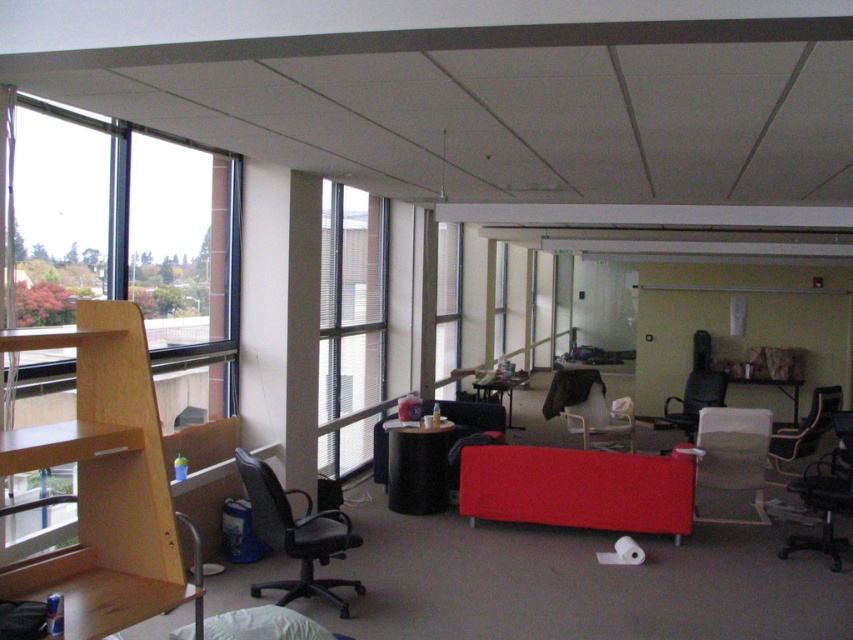
You are an office worker trying to locate the window to open it for fresh air. You see the clear glass window at center and the matte plastic table at center. Which object is located to the left of the other?

The clear glass window at center is positioned on the left side of matte plastic table at center, so the clear glass window at center is to the left of the matte plastic table at center.

You are an office worker who wants to place a large plant pot that is 2 meters tall on the metallic silver table at center. Considering the size of the clear glass window at center, will the plant pot obstruct the view through the window?

The clear glass window at center is larger than the metallic silver table at center. Since the plant pot is placed on the table, its height of 2 meters may not obstruct the entire view of the window, as the window is bigger in size. However, part of the window view might be blocked depending on the exact placement of the plant pot.